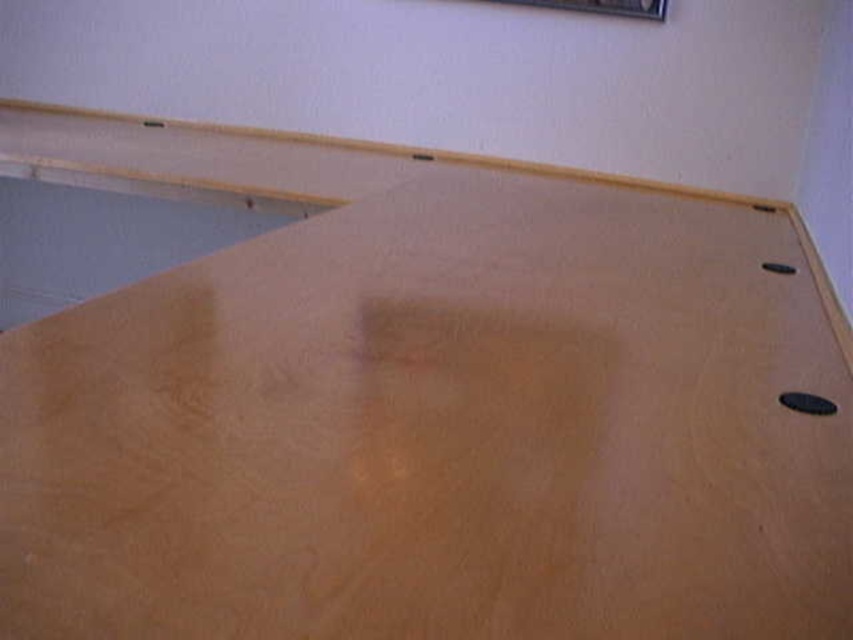
You are standing in the room and see two points marked on the wooden surface. The first point is at position point (x=105, y=545) and the second is at point (x=521, y=1). Which point is closer to you when facing the wooden surface?

Point (x=105, y=545) is in front of point (x=521, y=1), so it is closer to you when facing the wooden surface.

You are organizing items on the desk and need to place both the light brown wood table at upper center and the metallic silver picture frame at upper center. Since you want the picture frame to be visible, should you place the table behind or in front of the frame?

The light brown wood table at upper center is in front of the metallic silver picture frame at upper center, so to make the picture frame visible, you should place the table behind the frame instead of in front of it.